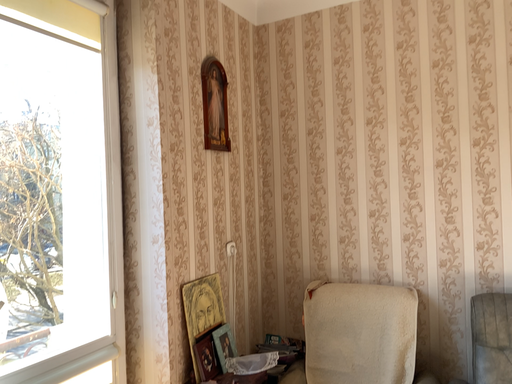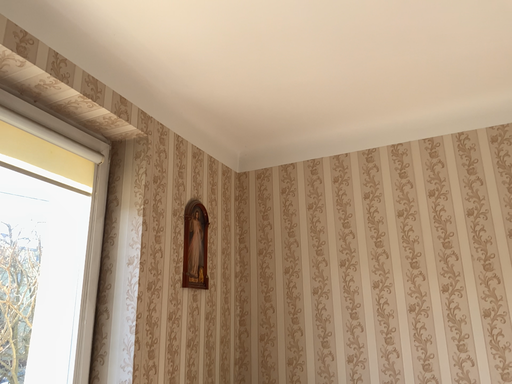
Question: Which way did the camera rotate in the video?

Choices:
 (A) rotated upward
 (B) rotated downward

Answer: (A)